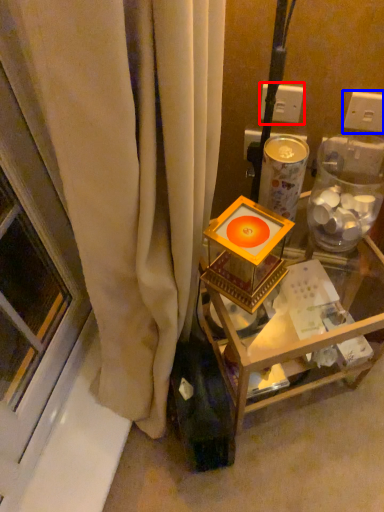
Question: Which point is closer to the camera, electric outlet (highlighted by a red box) or electric outlet (highlighted by a blue box)?

Choices:
 (A) electric outlet
 (B) electric outlet

Answer: (B)